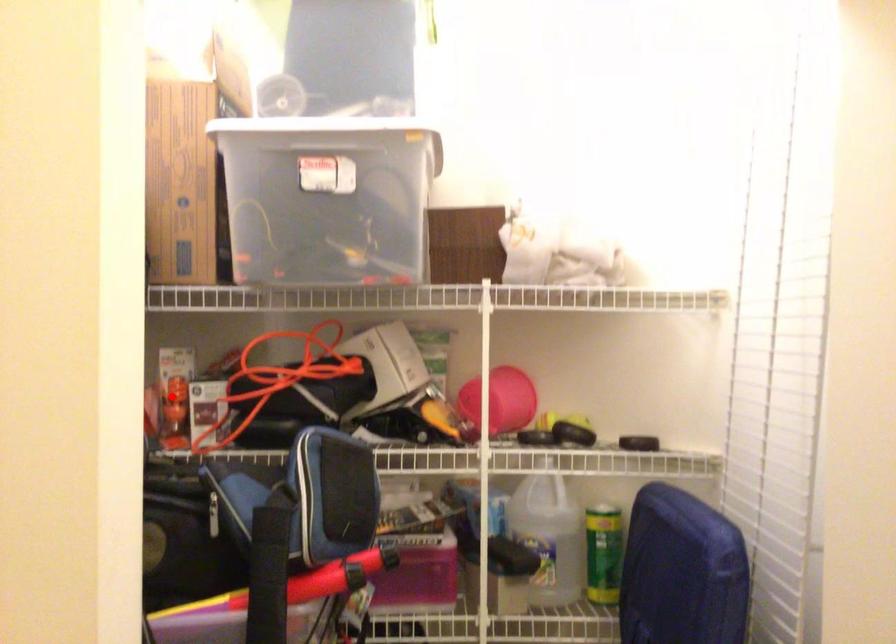
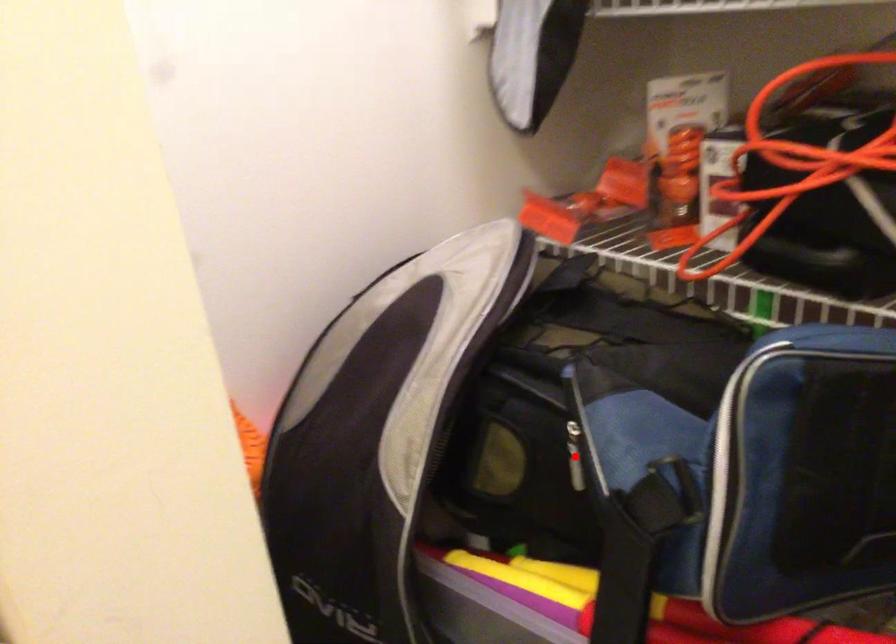
I am providing you with two images of the same scene from different viewpoints. A red point is marked on the first image and another point is marked on the second image. Do the highlighted points in image1 and image2 indicate the same real-world spot?

No